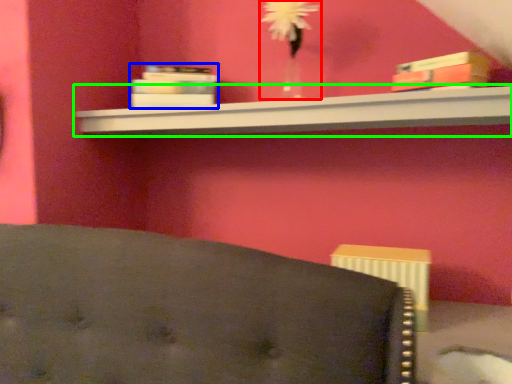
Question: Estimate the real-world distances between objects in this image. Which object is farther from floral arrangement (highlighted by a red box), book (highlighted by a blue box) or shelf (highlighted by a green box)?

Choices:
 (A) book
 (B) shelf

Answer: (A)